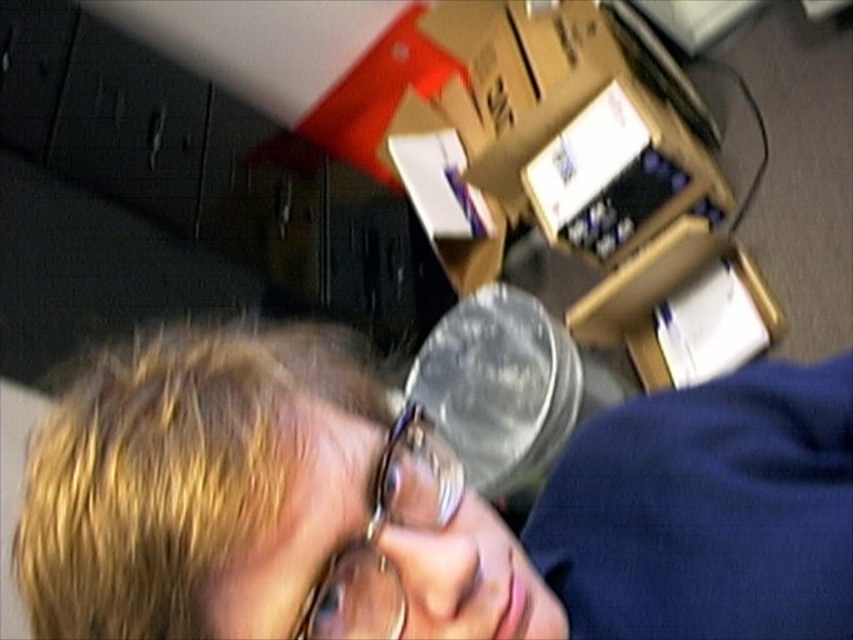
You are holding a pen and want to place it in the clear plastic cup at center without touching the blonde hair at center. Is this possible based on their positions?

The clear plastic cup at center is closer to the viewer than the blonde hair at center, so yes, you can place the pen in the clear plastic cup at center without touching the blonde hair at center.

You are standing in front of a cluttered desk and notice a point marked at coordinates (171,470). What is located at that point?

The point at (171,470) has blonde hair at center.